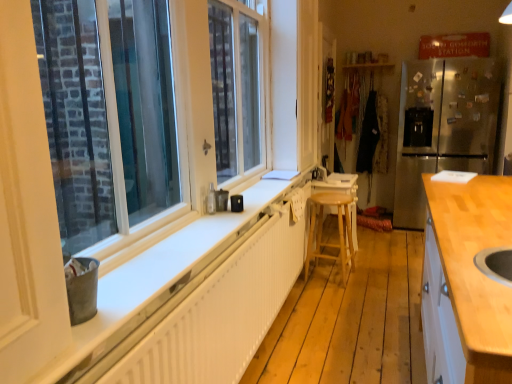
At what (x,y) coordinates should I click in order to perform the action: click on light wood countertop at right. Please return your answer as a coordinate pair (x, y). Looking at the image, I should click on (467, 281).

This screenshot has width=512, height=384. What do you see at coordinates (443, 126) in the screenshot? I see `stainless steel refrigerator at right` at bounding box center [443, 126].

Identify the location of stainless steel refrigerator at right. (443, 126).

Describe the element at coordinates (114, 123) in the screenshot. The height and width of the screenshot is (384, 512). I see `white plastic window at left` at that location.

In order to face white plastic window at left, should I rotate leftwards or rightwards?

It's best to rotate left around 8.104 degrees.

The image size is (512, 384). I want to click on light wood countertop at right, so click(x=467, y=281).

Is light brown wooden stool at center wider than stainless steel refrigerator at right?

No, light brown wooden stool at center is not wider than stainless steel refrigerator at right.

How different are the orientations of light brown wooden stool at center and stainless steel refrigerator at right in degrees?

The angle between the facing direction of light brown wooden stool at center and the facing direction of stainless steel refrigerator at right is 89 degrees.

Looking at this image, is light brown wooden stool at center smaller than stainless steel refrigerator at right?

Correct, light brown wooden stool at center occupies less space than stainless steel refrigerator at right.

Considering the sizes of light brown wooden stool at center and stainless steel refrigerator at right in the image, is light brown wooden stool at center taller or shorter than stainless steel refrigerator at right?

light brown wooden stool at center is shorter than stainless steel refrigerator at right.

In the image, there is a brushed metal faucet at center. Find the location of `bar stool below it (from the image's perspective)`. bar stool below it (from the image's perspective) is located at coordinates (338, 230).

Does light brown wooden stool at center have a greater width compared to brushed metal faucet at center?

Correct, the width of light brown wooden stool at center exceeds that of brushed metal faucet at center.

How many degrees apart are the facing directions of light brown wooden stool at center and brushed metal faucet at center?

28.3 degrees.

Are white textured radiator at lower center and light wood countertop at right far apart?

No, white textured radiator at lower center is in close proximity to light wood countertop at right.

Can you confirm if white textured radiator at lower center is wider than light wood countertop at right?

No.

Looking at this image, could you tell me if white textured radiator at lower center is facing light wood countertop at right?

Yes, white textured radiator at lower center is facing light wood countertop at right.

Does point (170, 365) come behind point (439, 188)?

No, it is not.

Measure the distance from stainless steel refrigerator at right to white textured radiator at lower center.

A distance of 2.52 meters exists between stainless steel refrigerator at right and white textured radiator at lower center.

From the image's perspective, relative to white textured radiator at lower center, is stainless steel refrigerator at right above or below?

stainless steel refrigerator at right is above white textured radiator at lower center.

I want to click on radiator that appears in front of the stainless steel refrigerator at right, so click(222, 313).

Is stainless steel refrigerator at right positioned in front of white textured radiator at lower center?

No, it is behind white textured radiator at lower center.

Can you confirm if stainless steel refrigerator at right is shorter than light wood countertop at right?

In fact, stainless steel refrigerator at right may be taller than light wood countertop at right.

Between stainless steel refrigerator at right and light wood countertop at right, which one appears on the right side from the viewer's perspective?

From the viewer's perspective, stainless steel refrigerator at right appears more on the right side.

Considering the sizes of stainless steel refrigerator at right and light wood countertop at right in the image, is stainless steel refrigerator at right bigger or smaller than light wood countertop at right?

Considering their sizes, stainless steel refrigerator at right takes up less space than light wood countertop at right.

Is stainless steel refrigerator at right thinner than light wood countertop at right?

Incorrect, the width of stainless steel refrigerator at right is not less than that of light wood countertop at right.

How much distance is there between wooden stool at center and brushed metal faucet at center?

wooden stool at center and brushed metal faucet at center are 8.34 inches apart from each other.

Is brushed metal faucet at center at the back of wooden stool at center?

No, brushed metal faucet at center is not at the back of wooden stool at center.

Which is more to the left, wooden stool at center or brushed metal faucet at center?

Positioned to the left is brushed metal faucet at center.

How many degrees apart are the facing directions of wooden stool at center and brushed metal faucet at center?

The angular difference between wooden stool at center and brushed metal faucet at center is 28.3 degrees.

Considering the points (199, 307) and (173, 69), which point is in front, point (199, 307) or point (173, 69)?

The point (199, 307) is more forward.

Is white plastic window at left located within white textured radiator at lower center?

No, white textured radiator at lower center does not contain white plastic window at left.

Is white textured radiator at lower center taller or shorter than white plastic window at left?

Clearly, white textured radiator at lower center is shorter compared to white plastic window at left.

Considering the relative positions of white textured radiator at lower center and white plastic window at left in the image provided, is white textured radiator at lower center to the right of white plastic window at left from the viewer's perspective?

Correct, you'll find white textured radiator at lower center to the right of white plastic window at left.

This screenshot has width=512, height=384. Identify the location of refrigerator on the right of light brown wooden stool at center. (443, 126).

The image size is (512, 384). Find the location of `faucet behind the light brown wooden stool at center`. faucet behind the light brown wooden stool at center is located at coordinates (319, 173).

Looking at the image, which one is located further to white textured radiator at lower center, white plastic window at left or stainless steel refrigerator at right?

Among the two, stainless steel refrigerator at right is located further to white textured radiator at lower center.

Looking at the image, which one is located further to white plastic window at left, white textured radiator at lower center or wooden stool at center?

wooden stool at center is positioned further to the anchor white plastic window at left.

Which object lies nearer to the anchor point brushed metal faucet at center, stainless steel refrigerator at right or wooden stool at center?

wooden stool at center is positioned closer to the anchor brushed metal faucet at center.

Based on their spatial positions, is brushed metal faucet at center or light brown wooden stool at center further from stainless steel refrigerator at right?

Among the two, light brown wooden stool at center is located further to stainless steel refrigerator at right.

Based on their spatial positions, is white textured radiator at lower center or stainless steel refrigerator at right further from light brown wooden stool at center?

The object further to light brown wooden stool at center is stainless steel refrigerator at right.

Considering their positions, is white textured radiator at lower center positioned closer to wooden stool at center than stainless steel refrigerator at right?

Among the two, stainless steel refrigerator at right is located nearer to wooden stool at center.

Based on the photo, estimate the real-world distances between objects in this image. Which object is closer to stainless steel refrigerator at right, light wood countertop at right or wooden stool at center?

wooden stool at center.

When comparing their distances from white plastic window at left, does light brown wooden stool at center or wooden stool at center seem closer?

Among the two, light brown wooden stool at center is located nearer to white plastic window at left.

I want to click on table positioned between white plastic window at left and brushed metal faucet at center from near to far, so click(343, 192).

Locate an element on the screen. This screenshot has width=512, height=384. window located between light wood countertop at right and wooden stool at center in the depth direction is located at coordinates (114, 123).

Locate an element on the screen. The width and height of the screenshot is (512, 384). window located between white textured radiator at lower center and stainless steel refrigerator at right in the depth direction is located at coordinates (114, 123).

Locate an element on the screen. This screenshot has width=512, height=384. radiator between light wood countertop at right and brushed metal faucet at center in the front-back direction is located at coordinates (222, 313).